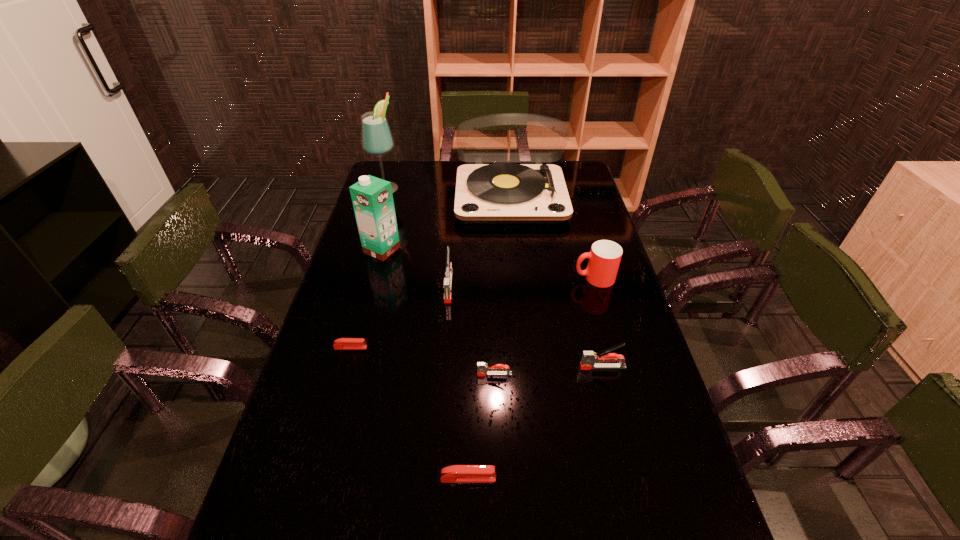
Locate an element on the screen. This screenshot has width=960, height=540. vacant point at the far edge is located at coordinates pyautogui.click(x=415, y=186).

Where is `vacant area at the left edge`? This screenshot has width=960, height=540. vacant area at the left edge is located at coordinates (309, 398).

Locate an element on the screen. The image size is (960, 540). vacant space at the right edge of the desktop is located at coordinates (675, 445).

I want to click on free point between the farthest stapler and the third farthest object, so click(416, 268).

In order to click on unoccupied area between the third shortest object and the nearer red stapler in this screenshot , I will do `click(481, 426)`.

This screenshot has width=960, height=540. In order to click on vacant area that lies between the carton and the red cup in this screenshot , I will do 488,264.

Identify the location of vacant area that lies between the record player and the carton. (446, 223).

This screenshot has height=540, width=960. Identify the location of free space between the leftmost stapler and the alcohol. (369, 267).

What are the coordinates of `free spot between the nearest gray stapler and the carton` in the screenshot? It's located at (438, 312).

The width and height of the screenshot is (960, 540). What are the coordinates of `empty space that is in between the bigger red stapler and the fourth shortest stapler` in the screenshot? It's located at (536, 423).